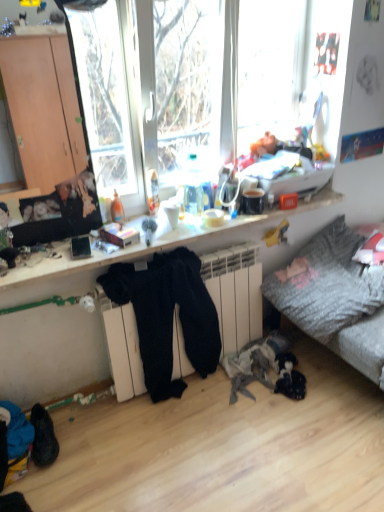
Question: In the image, is textured gray fabric couch at lower right positioned in front of or behind black suede shoes at lower left?

Choices:
 (A) behind
 (B) front

Answer: (A)

Question: Considering the positions of textured gray fabric couch at lower right and black suede shoes at lower left in the image, is textured gray fabric couch at lower right bigger or smaller than black suede shoes at lower left?

Choices:
 (A) big
 (B) small

Answer: (A)

Question: Based on their relative distances, which object is nearer to the black fuzzy pants at center?

Choices:
 (A) textured gray fabric couch at lower right
 (B) black suede shoes at lower left
 (C) wooden desk at center

Answer: (C)

Question: Based on their relative distances, which object is farther from the textured gray fabric couch at lower right?

Choices:
 (A) black suede shoes at lower left
 (B) black fuzzy pants at center
 (C) wooden desk at center

Answer: (A)